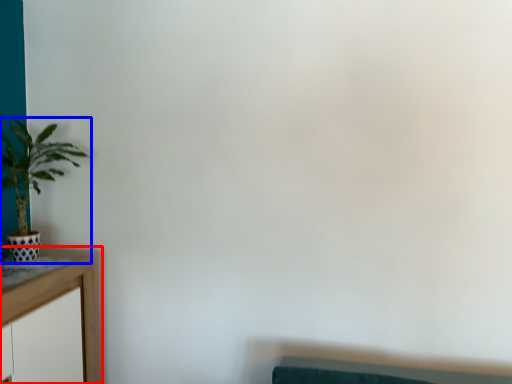
Question: Which object is closer to the camera taking this photo, table (highlighted by a red box) or houseplant (highlighted by a blue box)?

Choices:
 (A) table
 (B) houseplant

Answer: (A)